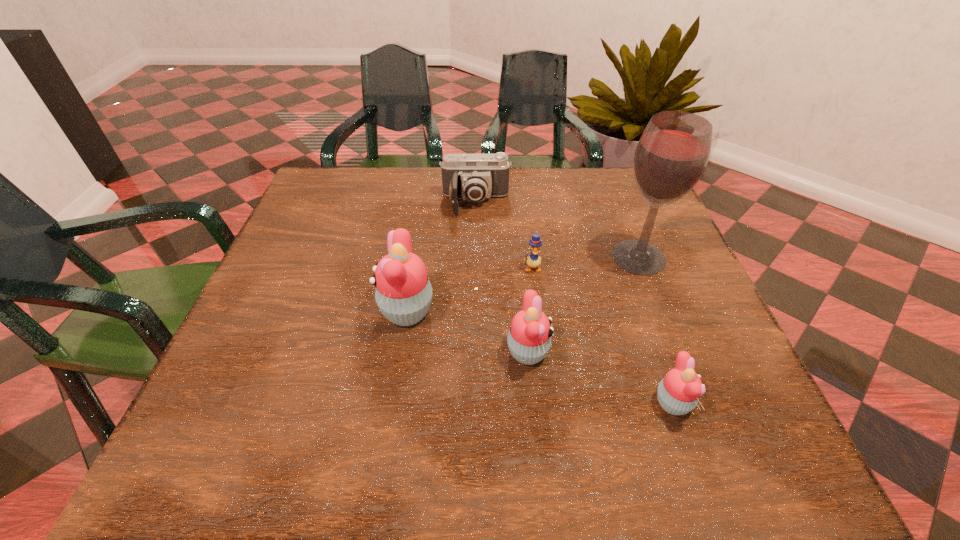
All cupcakes are currently evenly spaced. To continue this pattern, where would you add another cupcake on the left? Please point out a vacant spot. Please provide its 2D coordinates. Your answer should be formatted as a tuple, i.e. [(x, y)], where the tuple contains the x and y coordinates of a point satisfying the conditions above.

[(305, 275)]